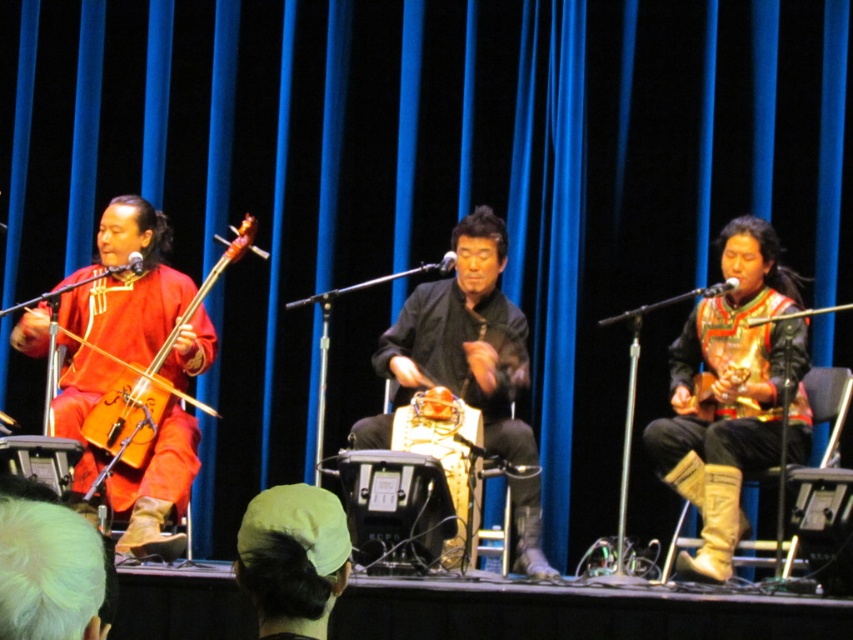
Consider the image. Is white hair at lower left positioned in front of green fabric cap at center?

Yes.

Consider the image. Does white hair at lower left have a larger size compared to green fabric cap at center?

Yes.

Find the location of `white hair at lower left`. white hair at lower left is located at coordinates (50, 572).

This screenshot has height=640, width=853. Find the location of `white hair at lower left`. white hair at lower left is located at coordinates (50, 572).

Does point (775, 461) lie in front of point (521, 326)?

Yes, point (775, 461) is closer to viewer.

Is gold leather boots at right thinner than black matte drum at center?

Yes.

Who is more distant from viewer, (715,371) or (508,403)?

The point (508,403) is more distant.

Locate an element on the screen. gold leather boots at right is located at coordinates (733, 394).

Who is positioned more to the left, gold leather boots at right or matte wood violin at left?

matte wood violin at left is more to the left.

Can you confirm if gold leather boots at right is positioned below matte wood violin at left?

Yes, gold leather boots at right is below matte wood violin at left.

The height and width of the screenshot is (640, 853). What are the coordinates of `gold leather boots at right` in the screenshot? It's located at (733, 394).